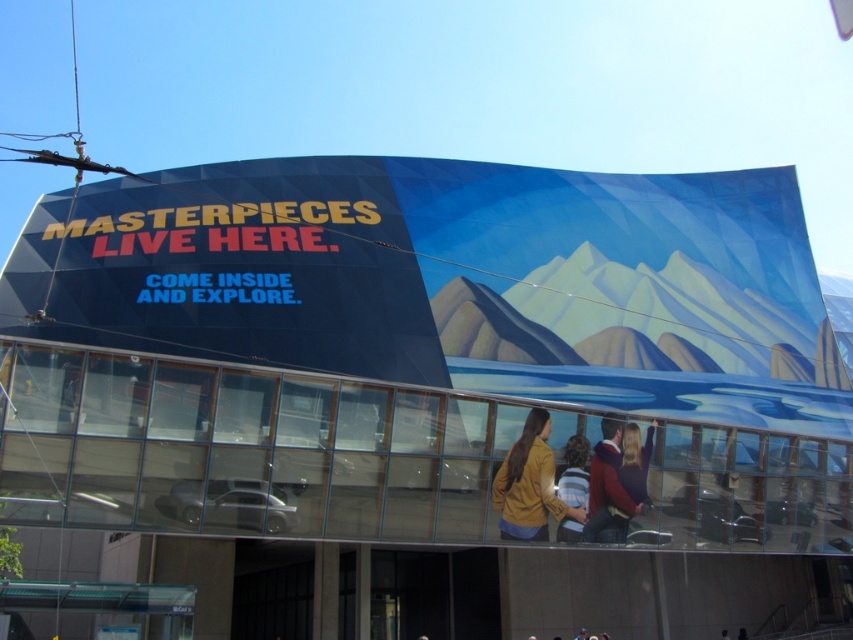
Question: Is matte yellow jacket at center positioned before striped sweater at center?

Choices:
 (A) yes
 (B) no

Answer: (A)

Question: Which object is positioned farthest from the matte yellow jacket at center?

Choices:
 (A) striped sweater at center
 (B) maroon sweater at center

Answer: (B)

Question: Among these objects, which one is nearest to the camera?

Choices:
 (A) maroon sweater at center
 (B) striped sweater at center

Answer: (B)

Question: Which of the following is the farthest from the observer?

Choices:
 (A) (561, 480)
 (B) (508, 516)

Answer: (A)

Question: Does maroon sweater at center appear over striped sweater at center?

Choices:
 (A) no
 (B) yes

Answer: (A)

Question: Can you confirm if maroon sweater at center is wider than striped sweater at center?

Choices:
 (A) no
 (B) yes

Answer: (A)